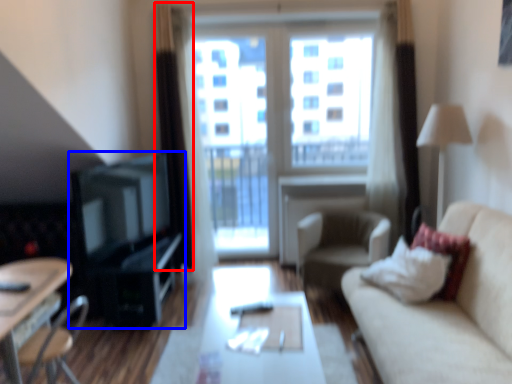
Question: Which of the following is the farthest to the observer, curtain (highlighted by a red box) or entertainment center (highlighted by a blue box)?

Choices:
 (A) curtain
 (B) entertainment center

Answer: (A)